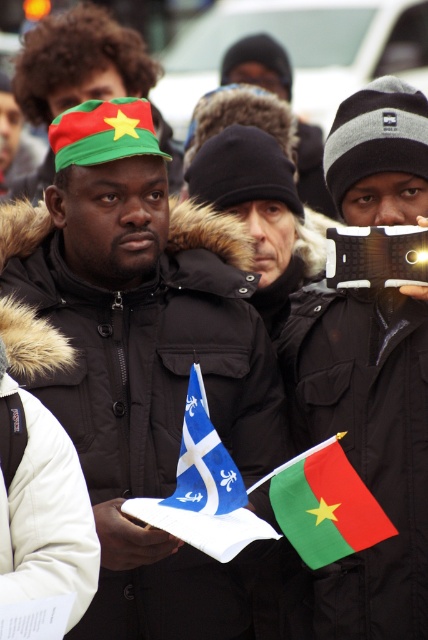
Can you confirm if black matte camera at center is shorter than black knit hat at center?

In fact, black matte camera at center may be taller than black knit hat at center.

Which of these two, black matte camera at center or black knit hat at center, stands shorter?

black knit hat at center

Where is `black matte camera at center`? This screenshot has height=640, width=428. black matte camera at center is located at coordinates (376, 257).

Is white fabric flag at center positioned behind black knit hat at center?

No, it is not.

Measure the distance between white fabric flag at center and camera.

white fabric flag at center and camera are 9.70 meters apart.

Who is more distant from viewer, [190,513] or [321,134]?

Point [321,134]

The image size is (428, 640). What are the coordinates of `white fabric flag at center` in the screenshot? It's located at pos(204,488).

Is matte black jacket at center shorter than green matte flag at center?

Incorrect, matte black jacket at center's height does not fall short of green matte flag at center's.

Which is above, matte black jacket at center or green matte flag at center?

matte black jacket at center is above.

What are the coordinates of `matte black jacket at center` in the screenshot? It's located at (139, 358).

Locate an element on the screen. matte black jacket at center is located at coordinates (139, 358).